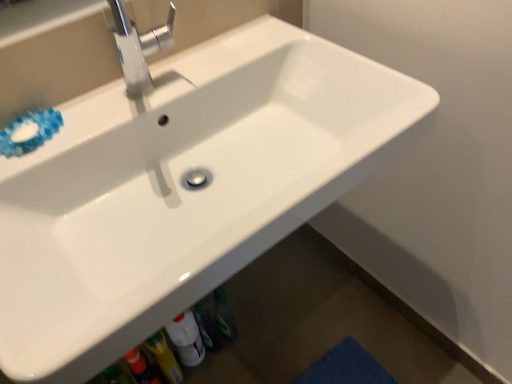
What do you see at coordinates (138, 46) in the screenshot? I see `polished metallic faucet at upper center` at bounding box center [138, 46].

You are a GUI agent. You are given a task and a screenshot of the screen. Output one action in this format:
    pyautogui.click(x=<x>, y=<y>)
    Task: Click on the polished metallic faucet at upper center
    The image size is (512, 384).
    Given the screenshot: What is the action you would take?
    pyautogui.click(x=138, y=46)

At what (x,y) coordinates should I click in order to perform the action: click on white glossy bottle at lower center. Please return your answer as a coordinate pair (x, y). Looking at the image, I should click on (186, 339).

The image size is (512, 384). Describe the element at coordinates (186, 339) in the screenshot. I see `white glossy bottle at lower center` at that location.

You are a GUI agent. You are given a task and a screenshot of the screen. Output one action in this format:
    pyautogui.click(x=<x>, y=<y>)
    Task: Click on the polished metallic faucet at upper center
    This screenshot has height=384, width=512.
    Given the screenshot: What is the action you would take?
    pyautogui.click(x=138, y=46)

Considering the relative positions of white glossy bottle at lower center and polished metallic faucet at upper center in the image provided, is white glossy bottle at lower center to the right of polished metallic faucet at upper center from the viewer's perspective?

Correct, you'll find white glossy bottle at lower center to the right of polished metallic faucet at upper center.

Which object is further away from the camera, white glossy bottle at lower center or polished metallic faucet at upper center?

white glossy bottle at lower center is more distant.

Which point is more forward, (185, 327) or (169, 15)?

Positioned in front is point (169, 15).

From the image's perspective, is white glossy bottle at lower center located above or below polished metallic faucet at upper center?

Clearly, from the image's perspective, white glossy bottle at lower center is below polished metallic faucet at upper center.

From a real-world perspective, who is located higher, white glossy bottle at lower center or polished metallic faucet at upper center?

polished metallic faucet at upper center.

Does white glossy bottle at lower center have a greater width compared to polished metallic faucet at upper center?

In fact, white glossy bottle at lower center might be narrower than polished metallic faucet at upper center.

Does white glossy bottle at lower center have a lesser height compared to polished metallic faucet at upper center?

No.

Who is smaller, white glossy bottle at lower center or polished metallic faucet at upper center?

With smaller size is white glossy bottle at lower center.

Can polished metallic faucet at upper center be found inside white glossy bottle at lower center?

No, polished metallic faucet at upper center is not inside white glossy bottle at lower center.

Is white glossy bottle at lower center far away from polished metallic faucet at upper center?

No, white glossy bottle at lower center is not far away from polished metallic faucet at upper center.

Is white glossy bottle at lower center positioned with its back to polished metallic faucet at upper center?

white glossy bottle at lower center does not have its back to polished metallic faucet at upper center.

How different are the orientations of white glossy bottle at lower center and polished metallic faucet at upper center in degrees?

The angular difference between white glossy bottle at lower center and polished metallic faucet at upper center is 2.23 degrees.

Image resolution: width=512 pixels, height=384 pixels. I want to click on bottle directly beneath the polished metallic faucet at upper center (from a real-world perspective), so click(x=186, y=339).

Visually, is polished metallic faucet at upper center positioned to the left or to the right of white glossy bottle at lower center?

polished metallic faucet at upper center is to the left of white glossy bottle at lower center.

Considering the positions of objects polished metallic faucet at upper center and white glossy bottle at lower center in the image provided, who is behind, polished metallic faucet at upper center or white glossy bottle at lower center?

white glossy bottle at lower center is further from the camera.

Based on the photo, which is more distant, (135,90) or (187,359)?

The point (187,359) is more distant.

From the image's perspective, does polished metallic faucet at upper center appear higher than white glossy bottle at lower center?

Yes, from the image's perspective, polished metallic faucet at upper center is on top of white glossy bottle at lower center.

From a real-world perspective, is polished metallic faucet at upper center positioned above or below white glossy bottle at lower center?

In terms of real-world spatial position, polished metallic faucet at upper center is above white glossy bottle at lower center.

Can you confirm if polished metallic faucet at upper center is wider than white glossy bottle at lower center?

Correct, the width of polished metallic faucet at upper center exceeds that of white glossy bottle at lower center.

Who is shorter, polished metallic faucet at upper center or white glossy bottle at lower center?

polished metallic faucet at upper center is shorter.

Based on their sizes in the image, would you say polished metallic faucet at upper center is bigger or smaller than white glossy bottle at lower center?

In the image, polished metallic faucet at upper center appears to be larger than white glossy bottle at lower center.

Is polished metallic faucet at upper center outside of white glossy bottle at lower center?

Indeed, polished metallic faucet at upper center is completely outside white glossy bottle at lower center.

Is polished metallic faucet at upper center touching white glossy bottle at lower center?

No, polished metallic faucet at upper center is not with white glossy bottle at lower center.

Is polished metallic faucet at upper center turned away from white glossy bottle at lower center?

No, white glossy bottle at lower center is not at the back of polished metallic faucet at upper center.

You are a GUI agent. You are given a task and a screenshot of the screen. Output one action in this format:
    pyautogui.click(x=<x>, y=<y>)
    Task: Click on the tap above the white glossy bottle at lower center (from the image's perspective)
    The height and width of the screenshot is (384, 512).
    Given the screenshot: What is the action you would take?
    pyautogui.click(x=138, y=46)

In order to click on bottle that is on the right side of polished metallic faucet at upper center in this screenshot , I will do `click(186, 339)`.

This screenshot has height=384, width=512. I want to click on bottle behind the polished metallic faucet at upper center, so click(x=186, y=339).